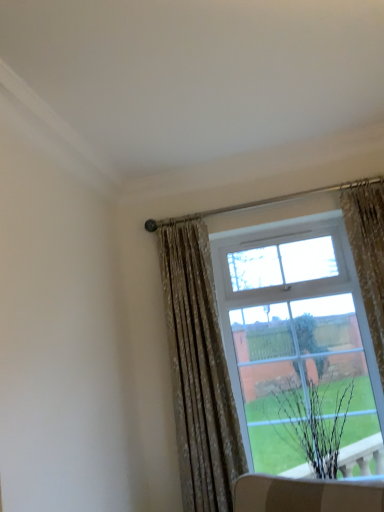
Question: Would you say floral fabric curtain at upper right, which is the 2th curtain in right-to-left order, is to the left or to the right of black matte plant at lower right in the picture?

Choices:
 (A) right
 (B) left

Answer: (B)

Question: Considering the positions of point (190, 458) and point (324, 386), is point (190, 458) closer or farther from the camera than point (324, 386)?

Choices:
 (A) farther
 (B) closer

Answer: (B)

Question: Estimate the real-world distances between objects in this image. Which object is closer to the floral fabric curtain at upper right, marked as the 1th curtain in a left-to-right arrangement?

Choices:
 (A) floral fabric curtain at right, placed as the second curtain when sorted from left to right
 (B) black matte plant at lower right

Answer: (B)

Question: Based on their relative distances, which object is nearer to the black matte plant at lower right?

Choices:
 (A) floral fabric curtain at upper right, marked as the 1th curtain in a left-to-right arrangement
 (B) floral fabric curtain at right, the 1th curtain in the right-to-left sequence

Answer: (A)